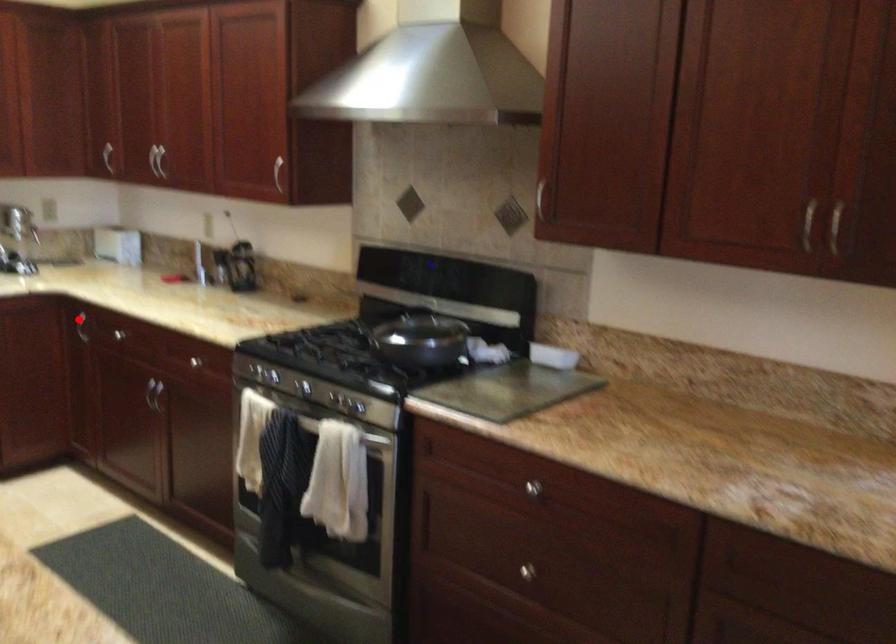
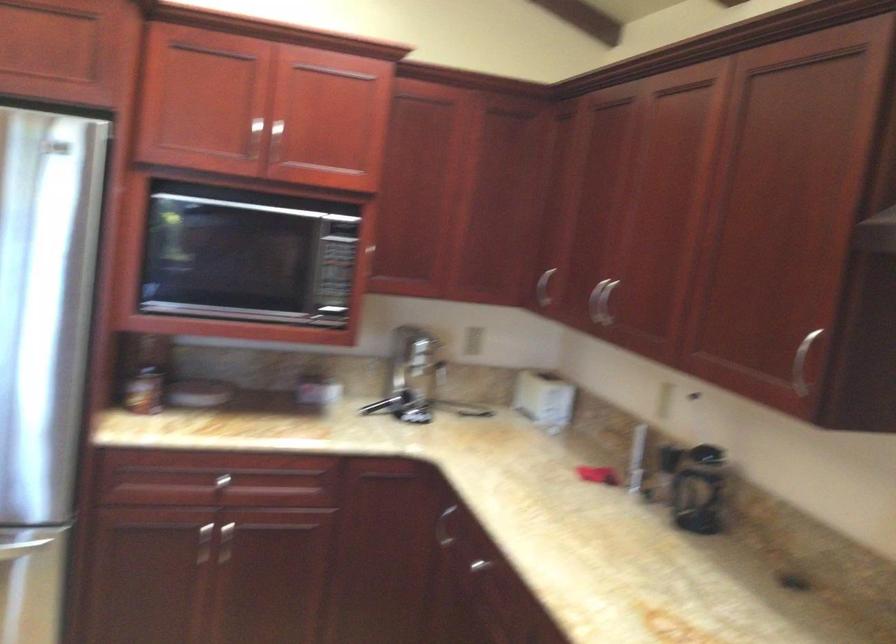
Locate, in the second image, the point that corresponds to the highlighted location in the first image.

(444, 527)